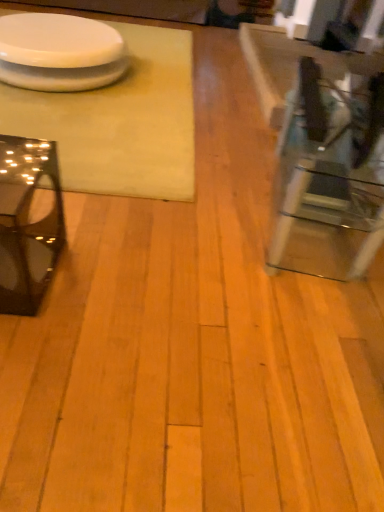
Question: Considering the relative positions of glossy black glass table at left, the second table from the left, and white matte table at upper left, acting as the first table starting from the left, in the image provided, is glossy black glass table at left, the second table from the left, behind white matte table at upper left, acting as the first table starting from the left,?

Choices:
 (A) no
 (B) yes

Answer: (A)

Question: From a real-world perspective, is glossy black glass table at left, which is the second table in right-to-left order, on white matte table at upper left, acting as the first table starting from the left?

Choices:
 (A) yes
 (B) no

Answer: (A)

Question: Can you confirm if glossy black glass table at left, the second table from the left, is positioned to the left of white matte table at upper left, which ranks as the third table in right-to-left order?

Choices:
 (A) yes
 (B) no

Answer: (B)

Question: Is glossy black glass table at left, the second table from the left, outside white matte table at upper left, which ranks as the third table in right-to-left order?

Choices:
 (A) yes
 (B) no

Answer: (A)

Question: Is the surface of glossy black glass table at left, which is the second table in right-to-left order, in direct contact with white matte table at upper left, which ranks as the third table in right-to-left order?

Choices:
 (A) no
 (B) yes

Answer: (A)

Question: In the image, is glossy black glass table at left, which is the second table in right-to-left order, on the left side or the right side of white glossy platter at upper left?

Choices:
 (A) left
 (B) right

Answer: (B)

Question: Does point (56, 245) appear closer or farther from the camera than point (33, 24)?

Choices:
 (A) closer
 (B) farther

Answer: (A)

Question: Based on their sizes in the image, would you say glossy black glass table at left, which is the second table in right-to-left order, is bigger or smaller than white glossy platter at upper left?

Choices:
 (A) small
 (B) big

Answer: (A)

Question: In terms of width, does glossy black glass table at left, which is the second table in right-to-left order, look wider or thinner when compared to white glossy platter at upper left?

Choices:
 (A) thin
 (B) wide

Answer: (A)

Question: Based on their sizes in the image, would you say glossy black glass table at left, which is the second table in right-to-left order, is bigger or smaller than white matte table at upper left, which ranks as the third table in right-to-left order?

Choices:
 (A) big
 (B) small

Answer: (B)

Question: Considering the positions of glossy black glass table at left, the second table from the left, and white matte table at upper left, which ranks as the third table in right-to-left order, in the image, is glossy black glass table at left, the second table from the left, wider or thinner than white matte table at upper left, which ranks as the third table in right-to-left order,?

Choices:
 (A) wide
 (B) thin

Answer: (B)

Question: Which is correct: glossy black glass table at left, the second table from the left, is inside white matte table at upper left, acting as the first table starting from the left, or outside of it?

Choices:
 (A) outside
 (B) inside

Answer: (A)

Question: From their relative heights in the image, would you say glossy black glass table at left, which is the second table in right-to-left order, is taller or shorter than white matte table at upper left, which ranks as the third table in right-to-left order?

Choices:
 (A) tall
 (B) short

Answer: (A)

Question: Is white matte table at upper left, acting as the first table starting from the left, spatially inside white glossy platter at upper left, or outside of it?

Choices:
 (A) outside
 (B) inside

Answer: (A)

Question: From a real-world perspective, is white matte table at upper left, which ranks as the third table in right-to-left order, physically located above or below white glossy platter at upper left?

Choices:
 (A) below
 (B) above

Answer: (A)